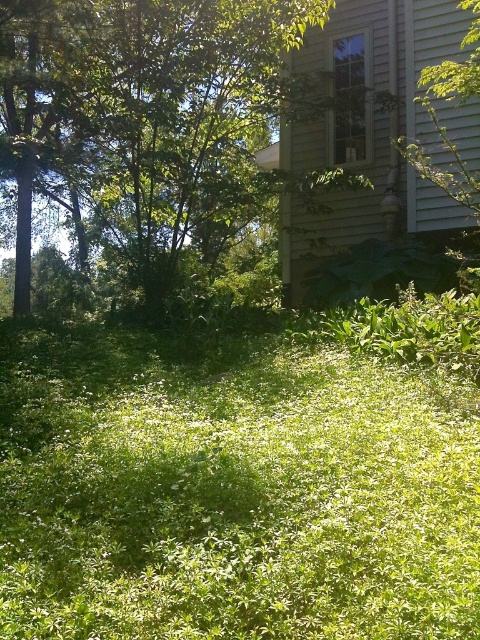
Question: Which point is closer to the camera taking this photo?

Choices:
 (A) (46, 605)
 (B) (205, 138)

Answer: (A)

Question: Can you confirm if green leafy grass at center is wider than green leafy tree at upper center?

Choices:
 (A) yes
 (B) no

Answer: (A)

Question: Does green leafy grass at center appear over green leafy tree at upper center?

Choices:
 (A) no
 (B) yes

Answer: (A)

Question: Which object is farther from the camera taking this photo?

Choices:
 (A) green leafy tree at upper center
 (B) green leafy grass at center

Answer: (A)

Question: Is green leafy grass at center bigger than green leafy tree at upper center?

Choices:
 (A) no
 (B) yes

Answer: (B)